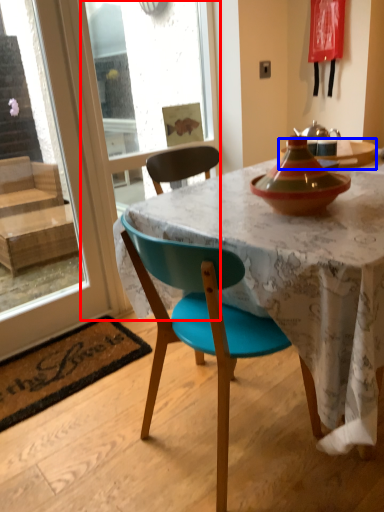
Question: Among these objects, which one is nearest to the camera, screen door (highlighted by a red box) or kitchen & dining room table (highlighted by a blue box)?

Choices:
 (A) screen door
 (B) kitchen & dining room table

Answer: (A)